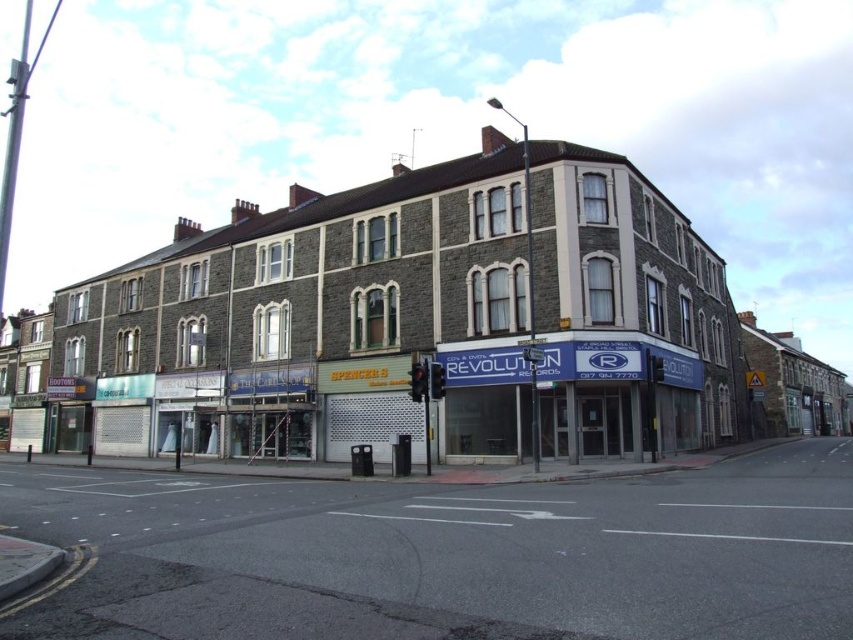
Question: Is gray concrete road at center closer to the viewer compared to blue matte signboard at center?

Choices:
 (A) no
 (B) yes

Answer: (B)

Question: Which point is closer to the camera?

Choices:
 (A) gray concrete road at center
 (B) stone building at center

Answer: (A)

Question: Among these points, which one is nearest to the camera?

Choices:
 (A) (839, 499)
 (B) (492, 372)

Answer: (A)

Question: In this image, where is stone building at center located relative to gray concrete road at center?

Choices:
 (A) right
 (B) left

Answer: (B)

Question: Is stone building at center to the left of gray concrete road at center from the viewer's perspective?

Choices:
 (A) no
 (B) yes

Answer: (B)

Question: Based on their relative distances, which object is nearer to the blue matte signboard at center?

Choices:
 (A) stone building at center
 (B) gray concrete road at center

Answer: (A)